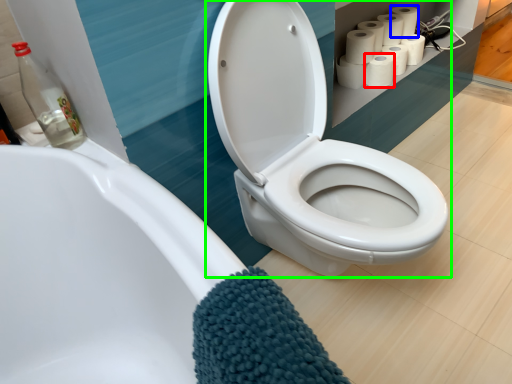
Question: Which object is positioned closest to toilet paper (highlighted by a red box)? Select from toilet paper (highlighted by a blue box) and toilet (highlighted by a green box).

Choices:
 (A) toilet paper
 (B) toilet

Answer: (A)